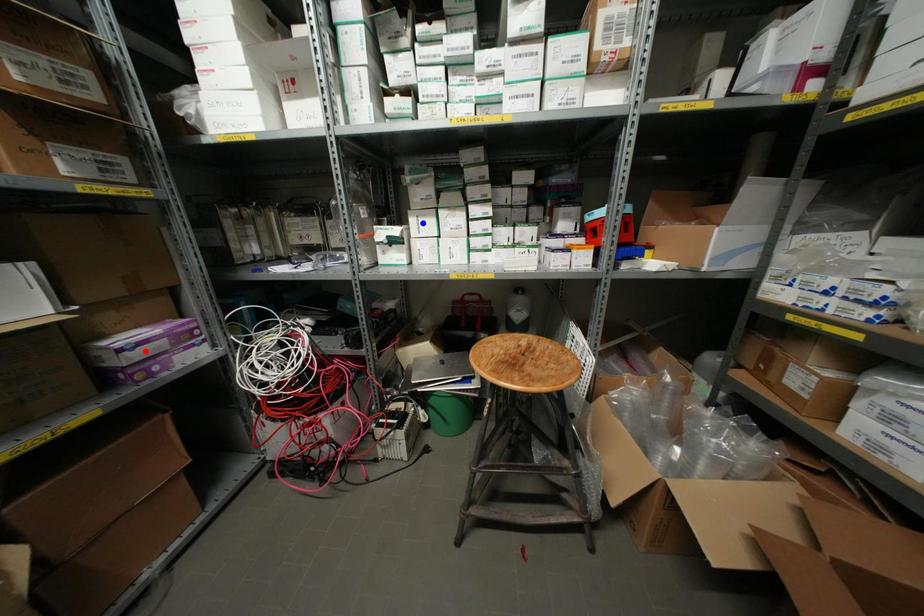
Question: Two points are marked on the image. Which point is closer to the camera?

Choices:
 (A) Blue point is closer.
 (B) Red point is closer.

Answer: (B)